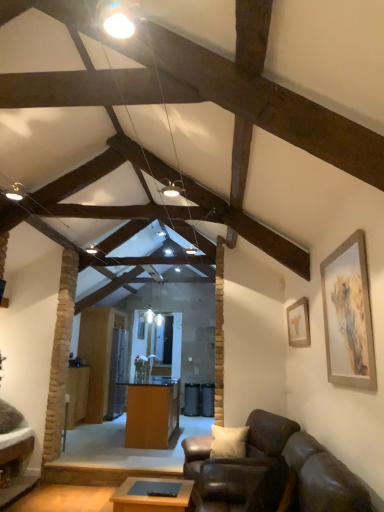
Question: Considering the relative sizes of leather couch at lower right and wooden table at center, marked as the second table in a front-to-back arrangement, in the image provided, is leather couch at lower right smaller than wooden table at center, marked as the second table in a front-to-back arrangement,?

Choices:
 (A) yes
 (B) no

Answer: (B)

Question: Considering the relative sizes of leather couch at lower right and wooden table at center, which is counted as the 1th table, starting from the back, in the image provided, is leather couch at lower right bigger than wooden table at center, which is counted as the 1th table, starting from the back,?

Choices:
 (A) no
 (B) yes

Answer: (B)

Question: From a real-world perspective, is leather couch at lower right below wooden table at center, marked as the second table in a front-to-back arrangement?

Choices:
 (A) no
 (B) yes

Answer: (B)

Question: From the image's perspective, is leather couch at lower right under wooden table at center, marked as the second table in a front-to-back arrangement?

Choices:
 (A) no
 (B) yes

Answer: (A)

Question: Is leather couch at lower right shorter than wooden table at center, marked as the second table in a front-to-back arrangement?

Choices:
 (A) yes
 (B) no

Answer: (A)

Question: Is point (153, 436) positioned closer to the camera than point (148, 499)?

Choices:
 (A) farther
 (B) closer

Answer: (A)

Question: Is orange wood desk at center wider or thinner than wooden table at center, which is the 1th table from front to back?

Choices:
 (A) wide
 (B) thin

Answer: (A)

Question: From their relative heights in the image, would you say orange wood desk at center is taller or shorter than wooden table at center, the first table from the right?

Choices:
 (A) tall
 (B) short

Answer: (A)

Question: From a real-world perspective, is orange wood desk at center positioned above or below wooden table at center, placed as the 2th table when sorted from left to right?

Choices:
 (A) below
 (B) above

Answer: (B)

Question: Choose the correct answer: Is wooden table at center, the second table in the back-to-front sequence, inside wooden table at center, marked as the second table in a front-to-back arrangement, or outside it?

Choices:
 (A) inside
 (B) outside

Answer: (B)

Question: Is point (153, 509) positioned closer to the camera than point (71, 370)?

Choices:
 (A) farther
 (B) closer

Answer: (B)

Question: Is wooden table at center, which is the 1th table from front to back, in front of or behind wooden table at center, the 2th table from the right, in the image?

Choices:
 (A) front
 (B) behind

Answer: (A)

Question: Looking at the image, does wooden table at center, the second table in the back-to-front sequence, seem bigger or smaller compared to wooden table at center, which is counted as the 1th table, starting from the back?

Choices:
 (A) big
 (B) small

Answer: (B)

Question: Is matte gold picture frame at upper right, which is counted as the second picture frame, starting from the front, to the left or to the right of orange wood desk at center in the image?

Choices:
 (A) right
 (B) left

Answer: (A)

Question: From the image's perspective, is matte gold picture frame at upper right, the second picture frame when ordered from left to right, located above or below orange wood desk at center?

Choices:
 (A) below
 (B) above

Answer: (B)